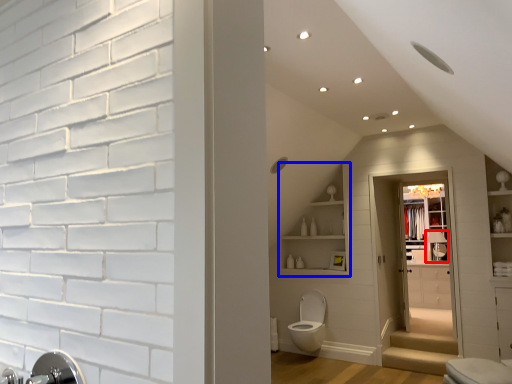
Question: Which of the following is the farthest to the observer, faucet (highlighted by a red box) or shelf (highlighted by a blue box)?

Choices:
 (A) faucet
 (B) shelf

Answer: (A)